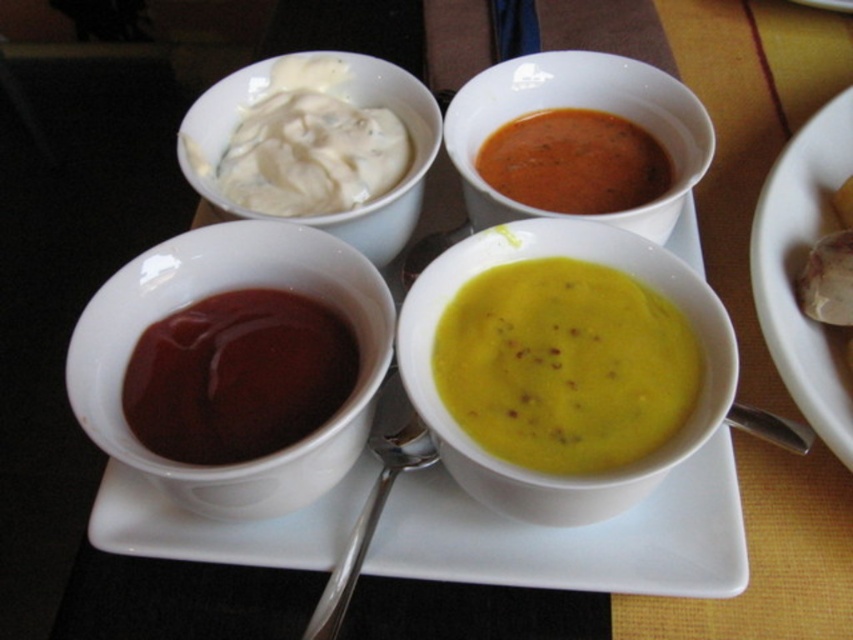
Question: Is matte ceramic sauce at left to the left of matte ceramic soup bowl at upper center from the viewer's perspective?

Choices:
 (A) yes
 (B) no

Answer: (A)

Question: Which object appears farthest from the camera in this image?

Choices:
 (A) smooth tomato soup at center
 (B) silver metallic spoon at lower center

Answer: (A)

Question: Can you confirm if matte white bowl at upper right is positioned to the right of silver metallic spoon at lower center?

Choices:
 (A) no
 (B) yes

Answer: (B)

Question: Which object appears farthest from the camera in this image?

Choices:
 (A) matte ceramic soup bowl at upper center
 (B) white creamy sauce at upper left
 (C) yellow matte soup bowl at center

Answer: (A)

Question: Does matte ceramic soup bowl at upper center appear under silver metallic spoon at lower center?

Choices:
 (A) yes
 (B) no

Answer: (B)

Question: Which of the following is the farthest from the observer?

Choices:
 (A) matte white bowl at upper right
 (B) white creamy sauce at upper left

Answer: (B)